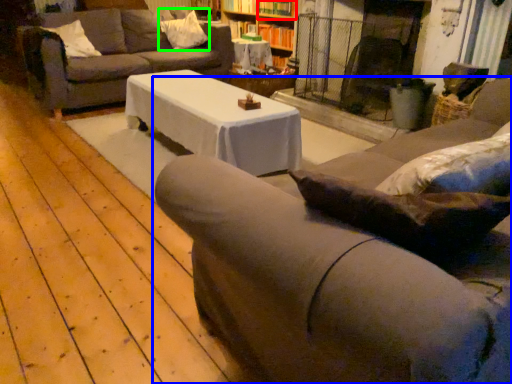
Question: Which object is positioned farthest from shelf (highlighted by a red box)? Select from studio couch (highlighted by a blue box) and pillow (highlighted by a green box).

Choices:
 (A) studio couch
 (B) pillow

Answer: (A)